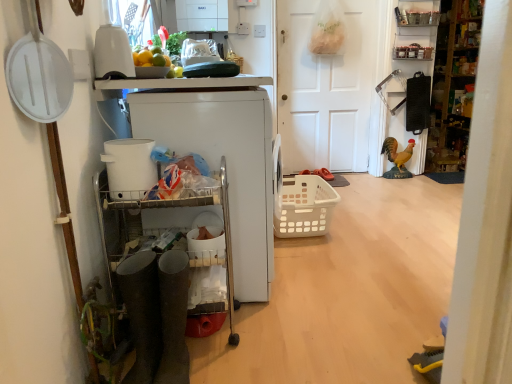
Question: Is white plastic cart at left, which appears as the 3th appliance when viewed from the front, far away from white plastic basket at center?

Choices:
 (A) yes
 (B) no

Answer: (B)

Question: From the image's perspective, is white plastic cart at left, the 1th appliance viewed from the back, located beneath white plastic basket at center?

Choices:
 (A) no
 (B) yes

Answer: (A)

Question: Is white plastic cart at left, the 1th appliance viewed from the back, positioned with its back to white plastic basket at center?

Choices:
 (A) no
 (B) yes

Answer: (A)

Question: Is white plastic cart at left, which appears as the 3th appliance when viewed from the front, thinner than white plastic basket at center?

Choices:
 (A) yes
 (B) no

Answer: (B)

Question: Is white plastic cart at left, the 1th appliance viewed from the back, smaller than white plastic basket at center?

Choices:
 (A) yes
 (B) no

Answer: (B)

Question: Is metallic silver spice rack at upper right, which is the 1th shelf in bottom-to-top order, taller or shorter than yellow matte rooster at right?

Choices:
 (A) short
 (B) tall

Answer: (A)

Question: From the image's perspective, relative to yellow matte rooster at right, is metallic silver spice rack at upper right, which is the 1th shelf in bottom-to-top order, above or below?

Choices:
 (A) below
 (B) above

Answer: (B)

Question: Considering their positions, is metallic silver spice rack at upper right, the second shelf viewed from the top, located in front of or behind yellow matte rooster at right?

Choices:
 (A) behind
 (B) front

Answer: (B)

Question: In the image, is metallic silver spice rack at upper right, which is the 1th shelf in bottom-to-top order, on the left side or the right side of yellow matte rooster at right?

Choices:
 (A) right
 (B) left

Answer: (A)

Question: Do you think white matte door at center is within rubber sole shoe at center, or outside of it?

Choices:
 (A) outside
 (B) inside

Answer: (A)

Question: Would you say white matte door at center is to the left or to the right of rubber sole shoe at center in the picture?

Choices:
 (A) left
 (B) right

Answer: (B)

Question: In the image, is white matte door at center positioned in front of or behind rubber sole shoe at center?

Choices:
 (A) behind
 (B) front

Answer: (B)

Question: From a real-world perspective, is white matte door at center physically located above or below rubber sole shoe at center?

Choices:
 (A) below
 (B) above

Answer: (B)

Question: Relative to yellow matte rooster at right, is white plastic cart at left, which appears as the 3th appliance when viewed from the front, in front or behind?

Choices:
 (A) front
 (B) behind

Answer: (A)

Question: Is point click(x=254, y=233) closer or farther from the camera than point click(x=400, y=157)?

Choices:
 (A) farther
 (B) closer

Answer: (B)